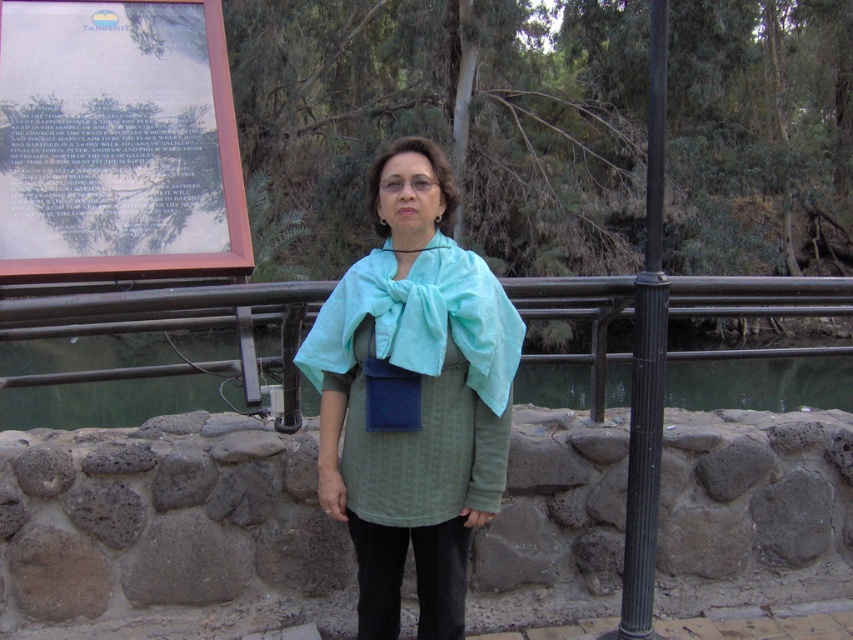
Question: Does teal fabric shawl at center have a greater width compared to metal/textured rail at center?

Choices:
 (A) no
 (B) yes

Answer: (A)

Question: Among these objects, which one is nearest to the camera?

Choices:
 (A) wooden signboard at upper left
 (B) metal/textured rail at center

Answer: (B)

Question: Which object appears farthest from the camera in this image?

Choices:
 (A) metal/textured rail at center
 (B) black metal pole at right
 (C) wooden signboard at upper left
 (D) teal fabric shawl at center

Answer: (C)

Question: Which point appears farthest from the camera in this image?

Choices:
 (A) (120, 260)
 (B) (444, 244)
 (C) (9, 321)

Answer: (A)

Question: Does teal fabric shawl at center appear over wooden signboard at upper left?

Choices:
 (A) no
 (B) yes

Answer: (A)

Question: Can you confirm if teal fabric shawl at center is positioned to the left of metal/textured rail at center?

Choices:
 (A) no
 (B) yes

Answer: (B)